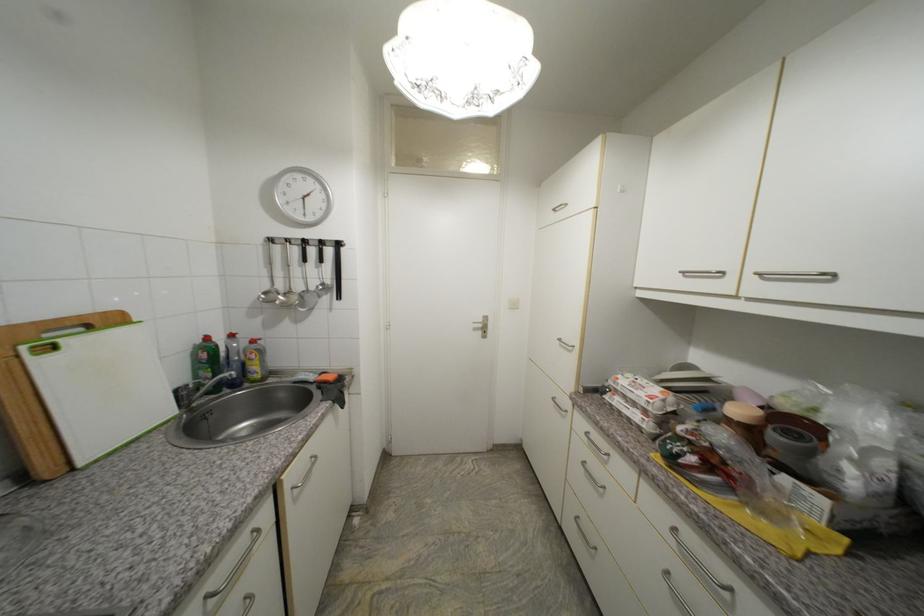
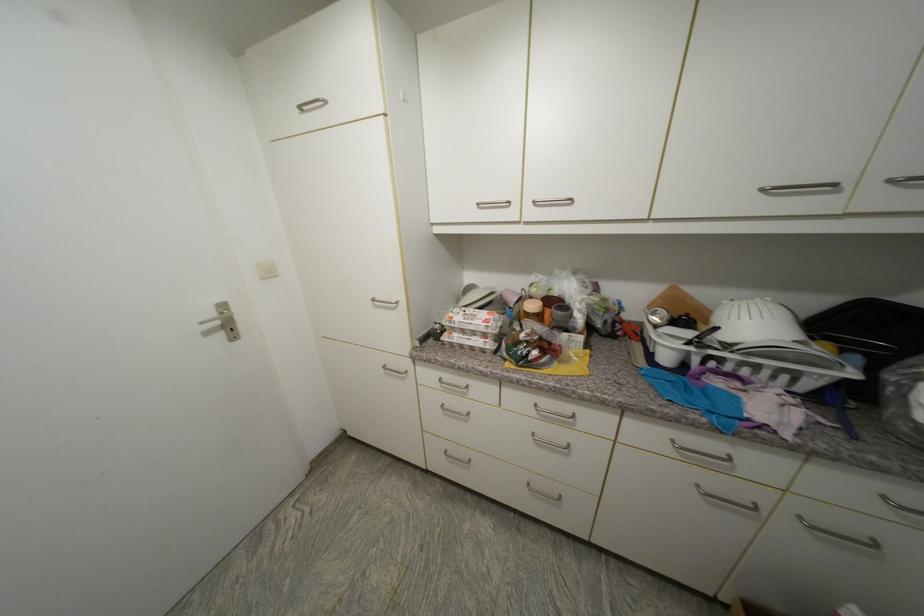
Locate, in the second image, the point that corresponds to (565,341) in the first image.

(379, 301)